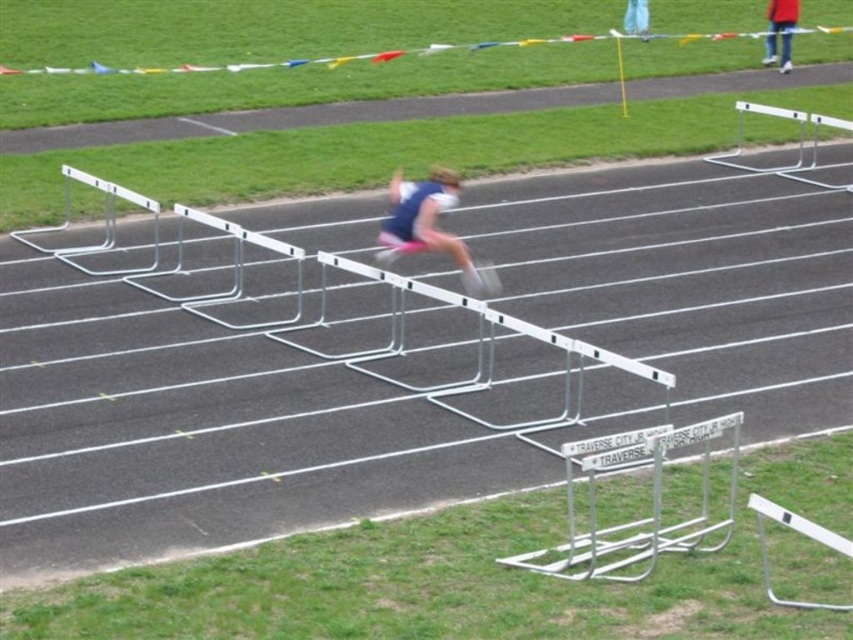
You are a track and field official assessing the race setup. You notice the silver metallic hurdle at center and the white fabric at upper center. Which object is higher in elevation?

The silver metallic hurdle at center is taller than the white fabric at upper center.